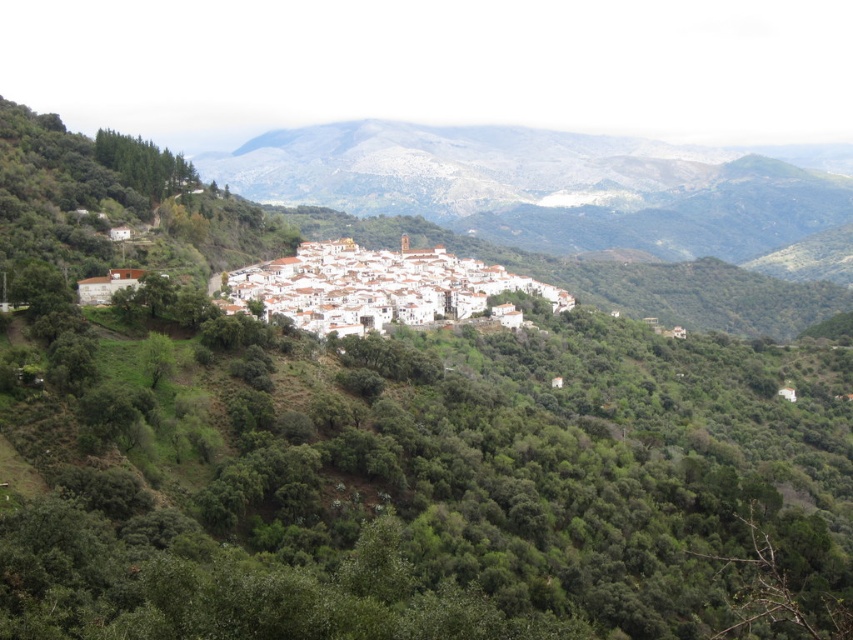
You are standing at the center of the village and see the point marked as point (560, 188). Which direction should you walk to reach the green leafy mountain at center?

The point (560, 188) represents the green leafy mountain at center, so you are already at the green leafy mountain at center.

You are standing in the village and want to hike to the green leafy mountain at center. If your hiking pace is 3 km per hour, how long will it take you to reach the mountain?

The green leafy mountain at center is 644.67 meters away. At a hiking pace of 3 km per hour, it would take approximately 13 minutes to reach the mountain.

You are a drone operator tasked with capturing aerial footage of the village. You notice the green leafy mountain at center and the white matte buildings at center. Which object should you focus on first if you want to film from a higher altitude to ensure both are visible in the frame?

The green leafy mountain at center is located above the white matte buildings at center, so focusing on the green leafy mountain at center first from a higher altitude will ensure both are visible in the frame.